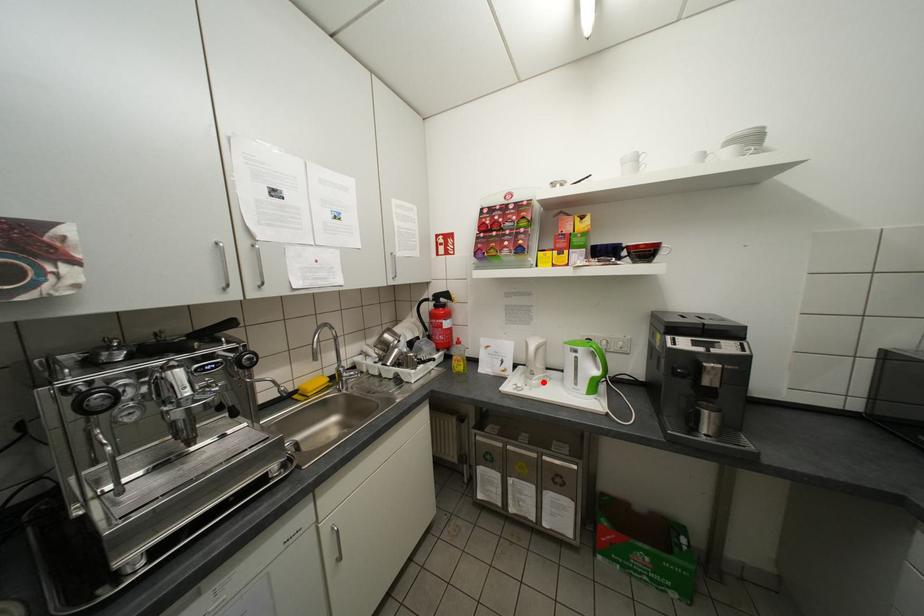
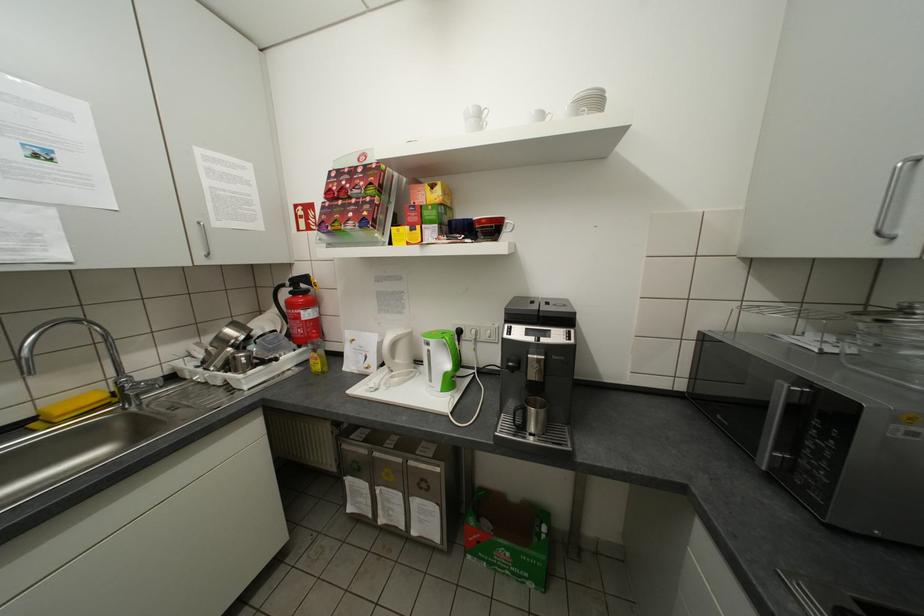
Where in the second image is the point corresponding to the highlighted location from the first image?

(406, 379)